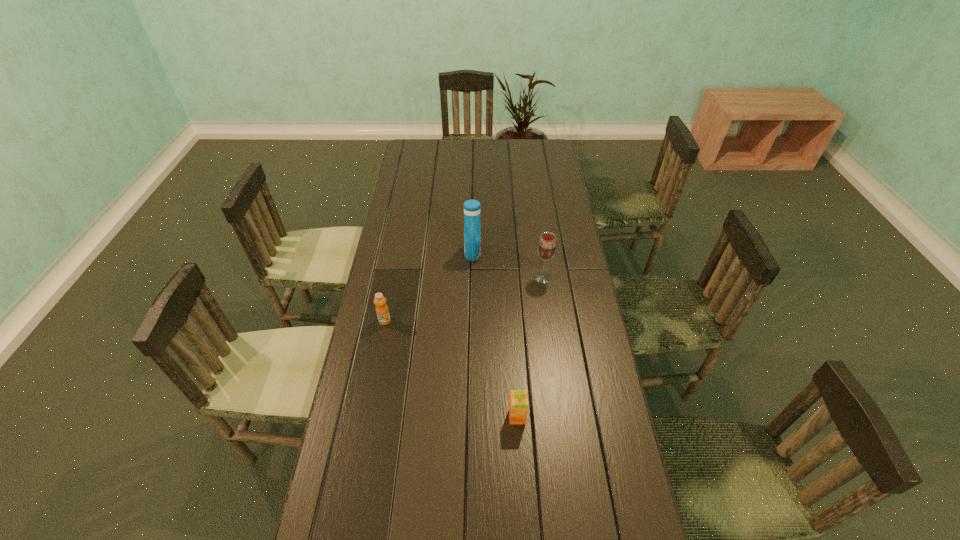
What are the coordinates of `the farthest object` in the screenshot? It's located at (472, 230).

Find the location of a particular element. This screenshot has width=960, height=540. detergent is located at coordinates (472, 230).

Identify the location of the third shortest object. This screenshot has height=540, width=960. (547, 246).

This screenshot has width=960, height=540. Identify the location of the third nearest object. (547, 246).

At what (x,y) coordinates should I click in order to perform the action: click on the third farthest object. Please return your answer as a coordinate pair (x, y). Image resolution: width=960 pixels, height=540 pixels. Looking at the image, I should click on (382, 311).

This screenshot has height=540, width=960. In order to click on the farther orange juice in this screenshot , I will do `click(382, 311)`.

This screenshot has height=540, width=960. What are the coordinates of `the nearest object` in the screenshot? It's located at (518, 407).

Image resolution: width=960 pixels, height=540 pixels. In order to click on the nearer orange juice in this screenshot , I will do `click(518, 407)`.

Image resolution: width=960 pixels, height=540 pixels. Identify the location of free space located 0.100m on the front-facing side of the farthest object. (507, 253).

You are a GUI agent. You are given a task and a screenshot of the screen. Output one action in this format:
    pyautogui.click(x=<x>, y=<y>)
    Task: Click on the vacant space located 0.170m on the left of the rightmost object
    
    Given the screenshot: What is the action you would take?
    pyautogui.click(x=486, y=278)